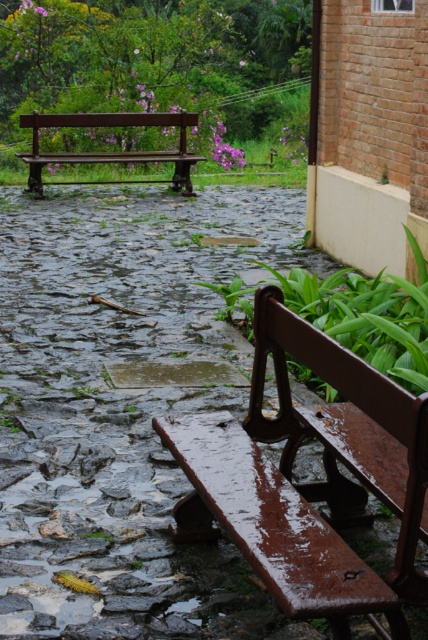
Question: Which of the following is the farthest from the observer?

Choices:
 (A) rusty wood bench at lower center
 (B) wet stone path at center
 (C) rustic wood bench at upper left

Answer: (C)

Question: Which point is closer to the camera?

Choices:
 (A) rustic wood bench at upper left
 (B) rusty wood bench at lower center
 (C) wet stone path at center

Answer: (B)

Question: Is the position of rusty wood bench at lower center less distant than that of rustic wood bench at upper left?

Choices:
 (A) no
 (B) yes

Answer: (B)

Question: Can you confirm if rusty wood bench at lower center is wider than rustic wood bench at upper left?

Choices:
 (A) yes
 (B) no

Answer: (B)

Question: From the image, what is the correct spatial relationship of wet stone path at center in relation to rustic wood bench at upper left?

Choices:
 (A) below
 (B) above

Answer: (A)

Question: Estimate the real-world distances between objects in this image. Which object is closer to the rusty wood bench at lower center?

Choices:
 (A) wet stone path at center
 (B) rustic wood bench at upper left

Answer: (A)